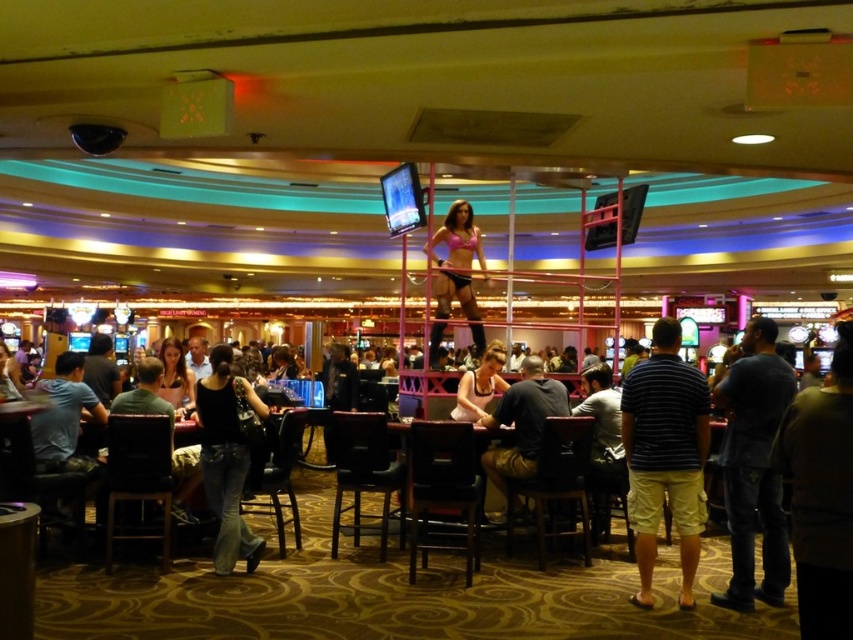
What are the coordinates of `matte black dress at center` in the screenshot? It's located at coord(177,378).

Does point (183, 360) come in front of point (457, 234)?

Yes.

Where is `matte black dress at center`? This screenshot has height=640, width=853. matte black dress at center is located at coordinates (177, 378).

Is point (474, 252) positioned after point (474, 246)?

Yes, point (474, 252) is behind point (474, 246).

What are the coordinates of `pink fabric bikini at center` in the screenshot? It's located at (456, 275).

Find the location of `pink fabric bikini at center`. pink fabric bikini at center is located at coordinates (456, 275).

Is pink fabric bikini at center positioned before matte black dress at center?

No.

The width and height of the screenshot is (853, 640). What do you see at coordinates (456, 275) in the screenshot? I see `pink fabric bikini at center` at bounding box center [456, 275].

Who is more forward, (444,260) or (181,408)?

Positioned in front is point (181,408).

Where is `pink fabric bikini at center`? The width and height of the screenshot is (853, 640). pink fabric bikini at center is located at coordinates (456, 275).